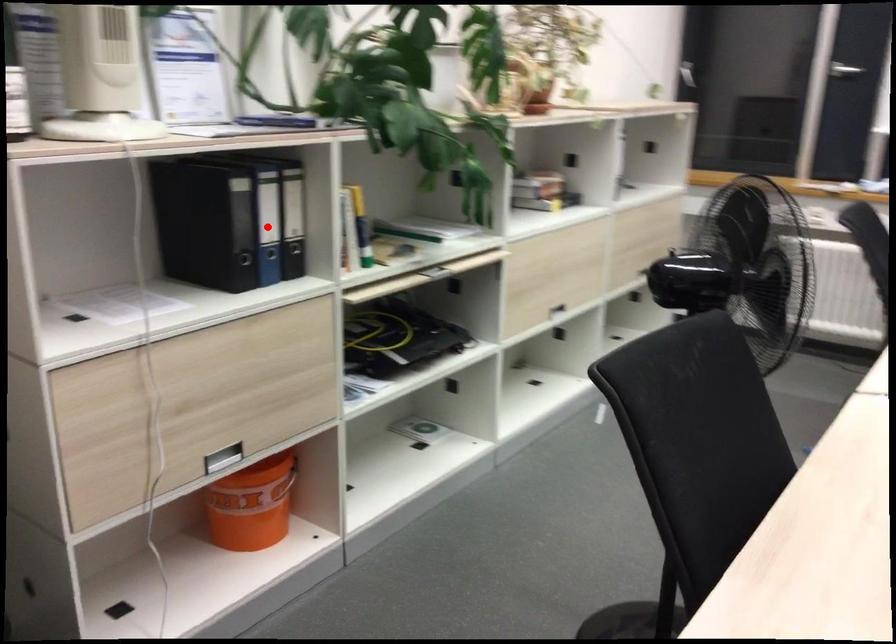
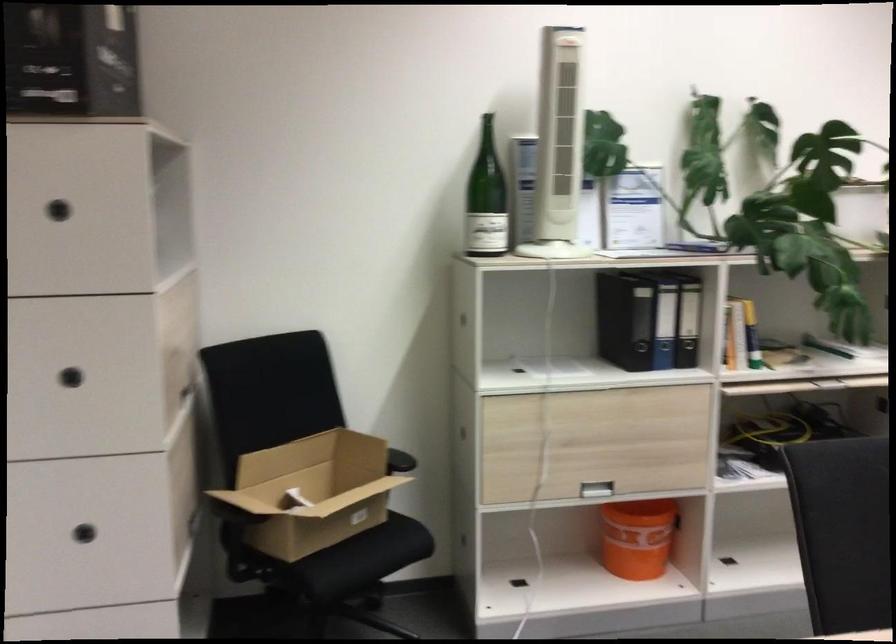
The point at the highlighted location is marked in the first image. Where is the corresponding point in the second image?

(664, 325)